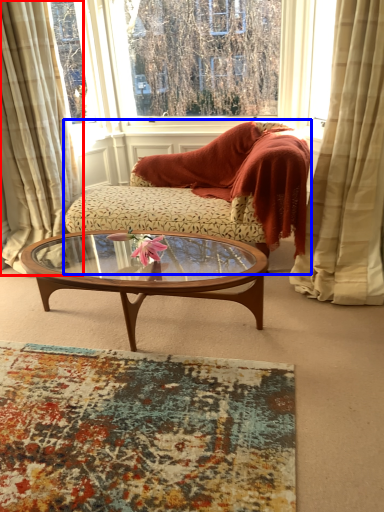
Question: Which point is further to the camera, curtain (highlighted by a red box) or studio couch (highlighted by a blue box)?

Choices:
 (A) curtain
 (B) studio couch

Answer: (B)